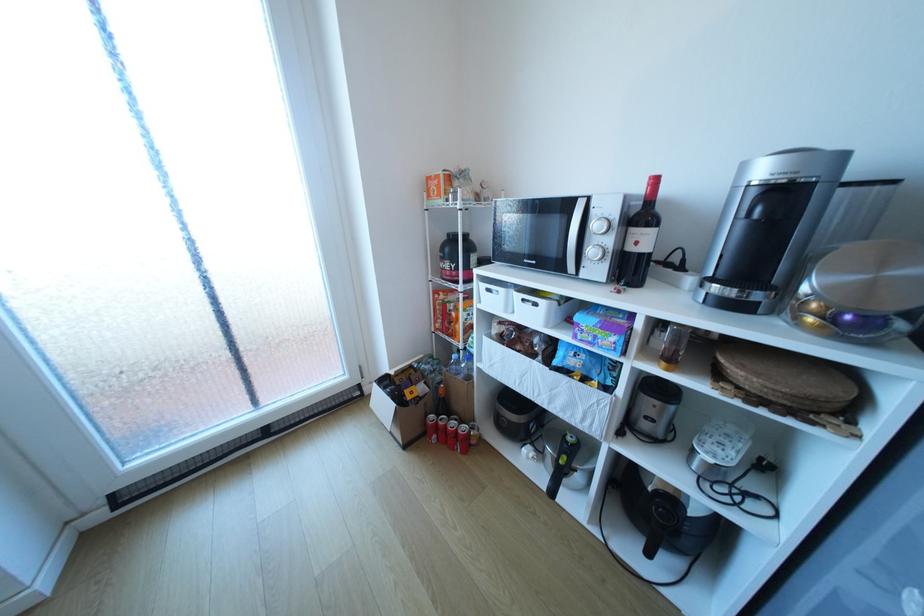
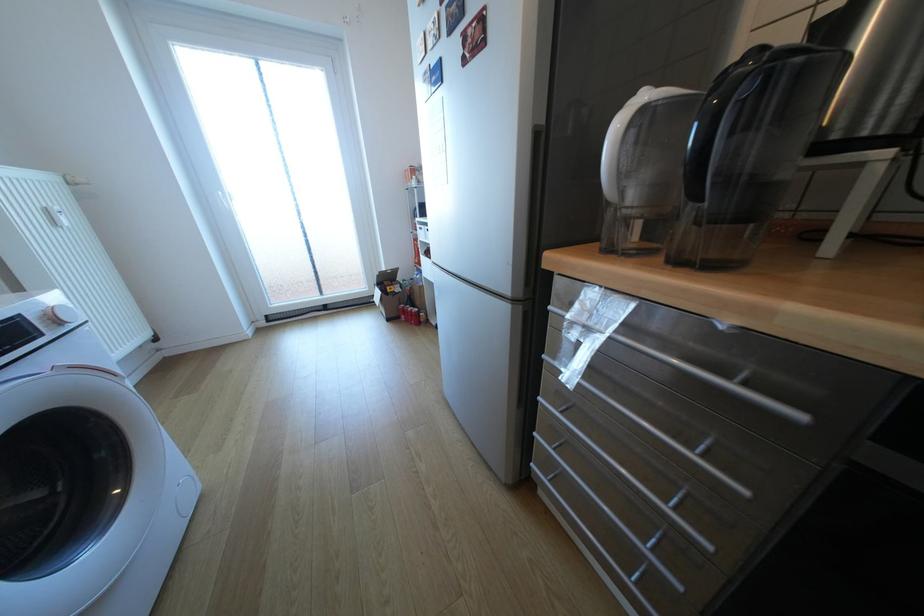
Find the pixel in the second image that matches pixel 416 392 in the first image.

(397, 288)